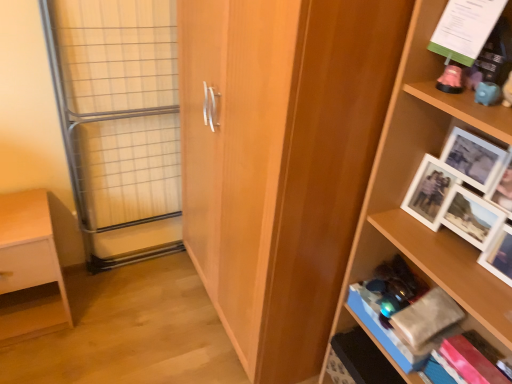
The height and width of the screenshot is (384, 512). I want to click on free spot below clear glass door at left (from a real-world perspective), so click(139, 264).